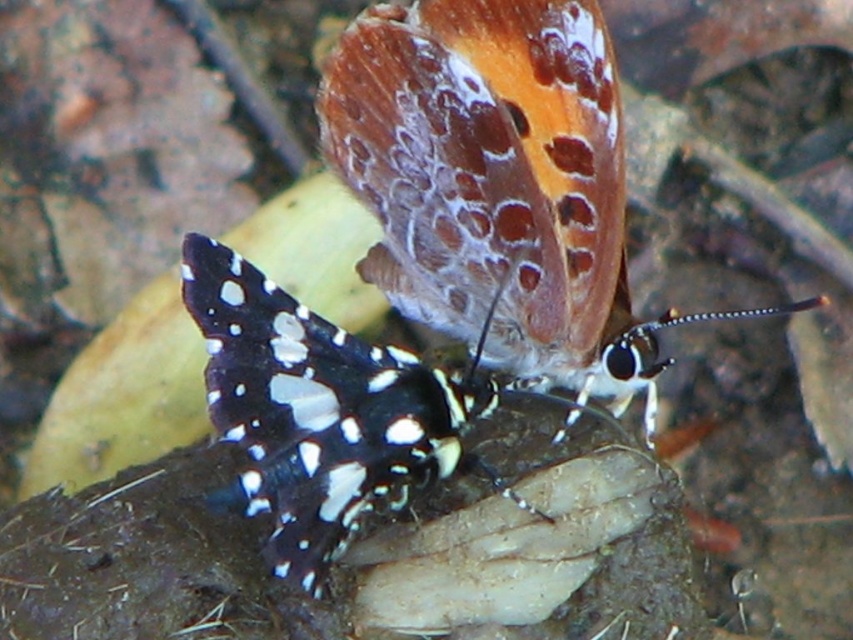
You are standing at the point marked as point (x=445, y=316). There are two butterflies in front of you. How far apart are the two butterflies?

The two butterflies are 4.73 feet apart.

Looking at this image, you are a photographer holding a camera and want to capture a close shot of the translucent orange butterfly at upper center. If you are currently 4 feet away from it, should you move closer or farther away to achieve the desired close shot?

The translucent orange butterfly at upper center is currently 4.25 feet away from the camera. Since you are 4 feet away, you are already closer than the required distance, so you should move slightly farther away to match the ideal distance for a close shot.

You are an entomologist observing two butterflies on a leaf. The translucent orange butterfly at upper center and the black and white spotted butterfly at center. Which butterfly is positioned higher on the leaf?

The translucent orange butterfly at upper center is positioned higher on the leaf than the black and white spotted butterfly at center.